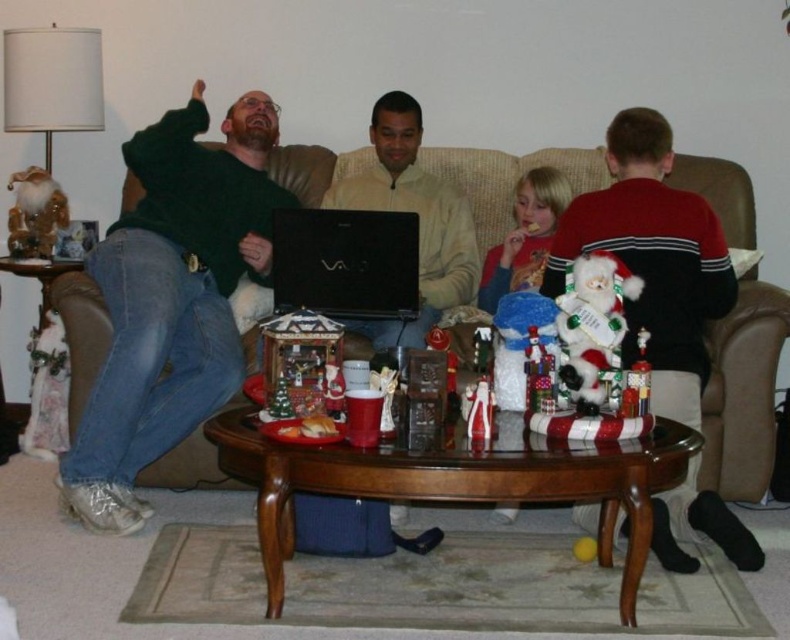
Question: Which of these objects is positioned closest to the white plush santa at left?

Choices:
 (A) black matte laptop at center
 (B) blonde hair at center
 (C) blonde hair boy at center

Answer: (A)

Question: Estimate the real-world distances between objects in this image. Which object is closer to the white plush santa at left?

Choices:
 (A) light beige sweater at center
 (B) blonde hair at center

Answer: (A)

Question: Is light beige sweater at center above black matte laptop at center?

Choices:
 (A) no
 (B) yes

Answer: (B)

Question: Can you confirm if brown leather couch at center is positioned below blonde hair boy at center?

Choices:
 (A) yes
 (B) no

Answer: (A)

Question: Is brown leather couch at center thinner than black matte laptop at center?

Choices:
 (A) yes
 (B) no

Answer: (A)

Question: Based on their relative distances, which object is nearer to the black matte laptop at center?

Choices:
 (A) brown leather couch at center
 (B) blonde hair boy at center
 (C) blonde hair at center

Answer: (C)